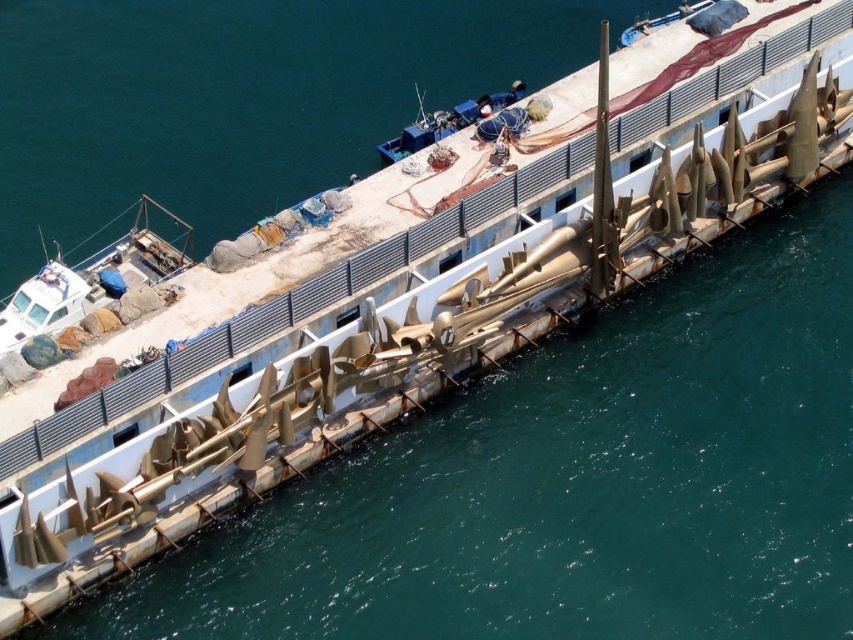
Question: Can you confirm if white matte boat at left is thinner than blue plastic boat at upper center?

Choices:
 (A) yes
 (B) no

Answer: (B)

Question: Which point is closer to the camera?

Choices:
 (A) (500, 96)
 (B) (38, 312)

Answer: (B)

Question: Which point is farther to the camera?

Choices:
 (A) (107, 272)
 (B) (477, 106)

Answer: (B)

Question: Is white matte boat at left smaller than blue plastic boat at upper center?

Choices:
 (A) no
 (B) yes

Answer: (A)

Question: Is white matte boat at left positioned at the back of blue plastic boat at upper center?

Choices:
 (A) no
 (B) yes

Answer: (A)